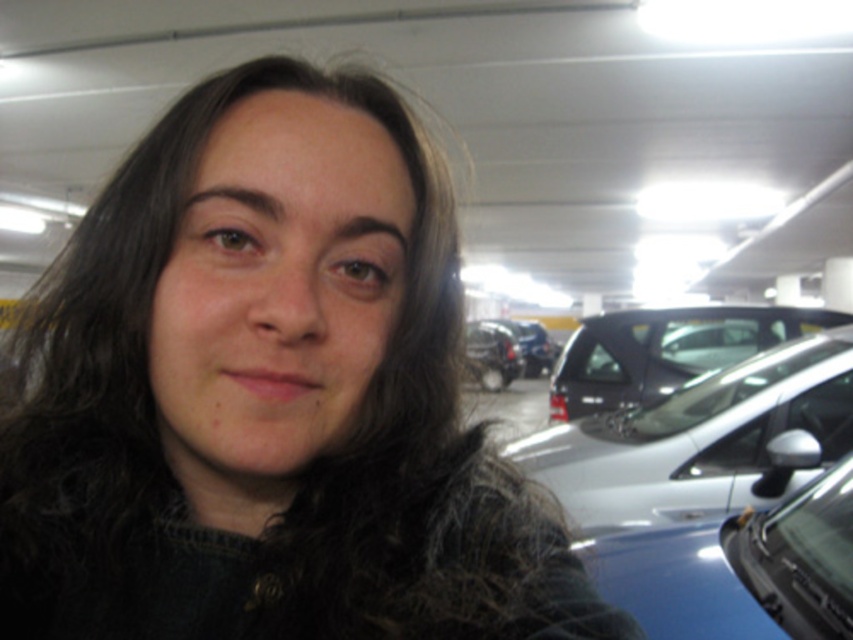
Question: Which is farther from the satin silver car at right?

Choices:
 (A) shiny black suv at center
 (B) shiny black car at center
 (C) dark brown hair at center

Answer: (B)

Question: Which of the following is the closest to the observer?

Choices:
 (A) satin silver car at right
 (B) shiny black suv at center
 (C) shiny black car at center
 (D) dark brown hair at center

Answer: (D)

Question: Which object is farther from the camera taking this photo?

Choices:
 (A) shiny black car at center
 (B) dark brown hair at center
 (C) shiny black suv at center
 (D) satin silver car at right

Answer: (A)

Question: Does shiny black suv at center come in front of shiny black car at center?

Choices:
 (A) yes
 (B) no

Answer: (A)

Question: From the image, what is the correct spatial relationship of satin silver car at right in relation to shiny black suv at center?

Choices:
 (A) below
 (B) above

Answer: (A)

Question: Is the position of satin silver car at right more distant than that of shiny black car at center?

Choices:
 (A) yes
 (B) no

Answer: (B)